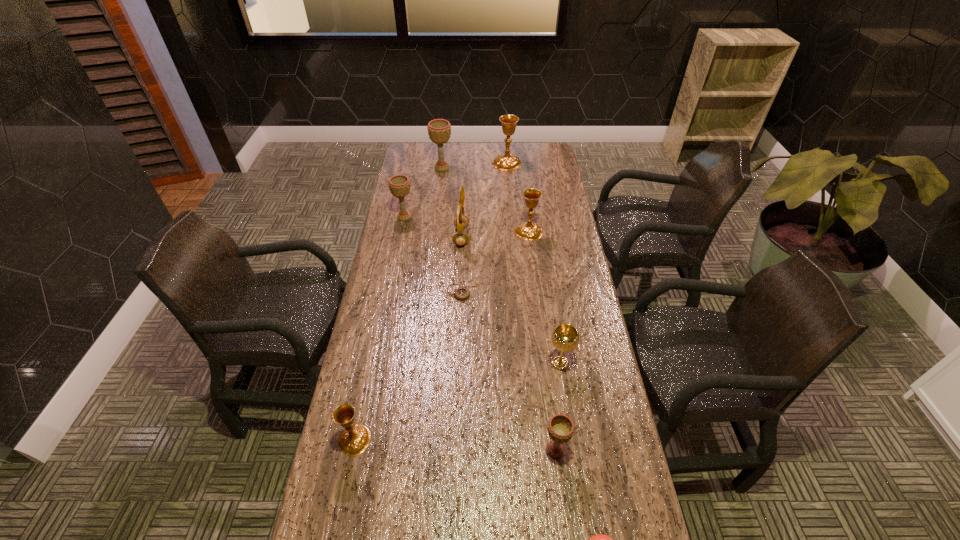
Image resolution: width=960 pixels, height=540 pixels. What are the coordinates of `free space located 0.090m on the left of the rightmost beige chalice` in the screenshot? It's located at (508, 450).

Identify the location of vacant space located 0.070m on the back of the leftmost gold chalice. Image resolution: width=960 pixels, height=540 pixels. (362, 401).

Locate an element on the screen. This screenshot has width=960, height=540. free location located on the left of the sixth farthest object is located at coordinates (429, 289).

Locate an element on the screen. object located at the far left corner is located at coordinates (439, 130).

Locate an element on the screen. The width and height of the screenshot is (960, 540). vacant space at the far edge of the desktop is located at coordinates pos(523,164).

In the image, there is a desktop. Where is `vacant space at the left edge`? This screenshot has height=540, width=960. vacant space at the left edge is located at coordinates pos(418,180).

Where is `blank space at the right edge`? This screenshot has width=960, height=540. blank space at the right edge is located at coordinates (538, 254).

You are a GUI agent. You are given a task and a screenshot of the screen. Output one action in this format:
    pyautogui.click(x=<x>, y=<y>)
    Task: Click on the vacant space at the far right corner
    This screenshot has height=540, width=960.
    Given the screenshot: What is the action you would take?
    [549, 160]

At what (x,y) coordinates should I click in order to perform the action: click on vacant region between the second nearest beige chalice and the sixth farthest object. Please return your answer as a coordinate pair (x, y). This screenshot has height=540, width=960. Looking at the image, I should click on click(x=433, y=253).

You are a GUI agent. You are given a task and a screenshot of the screen. Output one action in this format:
    pyautogui.click(x=<x>, y=<y>)
    Task: Click on the empty space between the biggest gold chalice and the third object from left to right
    
    Given the screenshot: What is the action you would take?
    pyautogui.click(x=474, y=166)